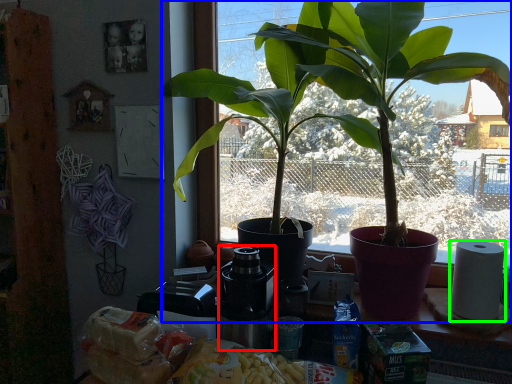
Question: Estimate the real-world distances between objects in this image. Which object is closer to coffee machine (highlighted by a red box), houseplant (highlighted by a blue box) or paper towel (highlighted by a green box)?

Choices:
 (A) houseplant
 (B) paper towel

Answer: (A)